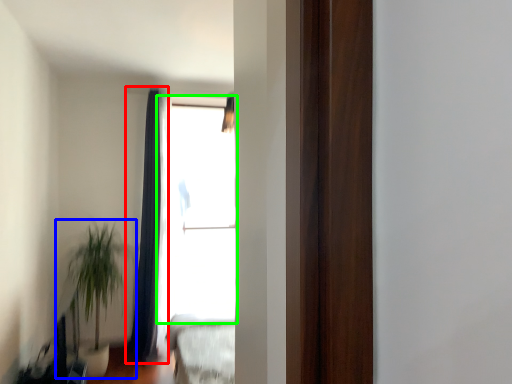
Question: Which object is positioned closest to curtain (highlighted by a red box)? Select from houseplant (highlighted by a blue box) and window (highlighted by a green box).

Choices:
 (A) houseplant
 (B) window

Answer: (B)